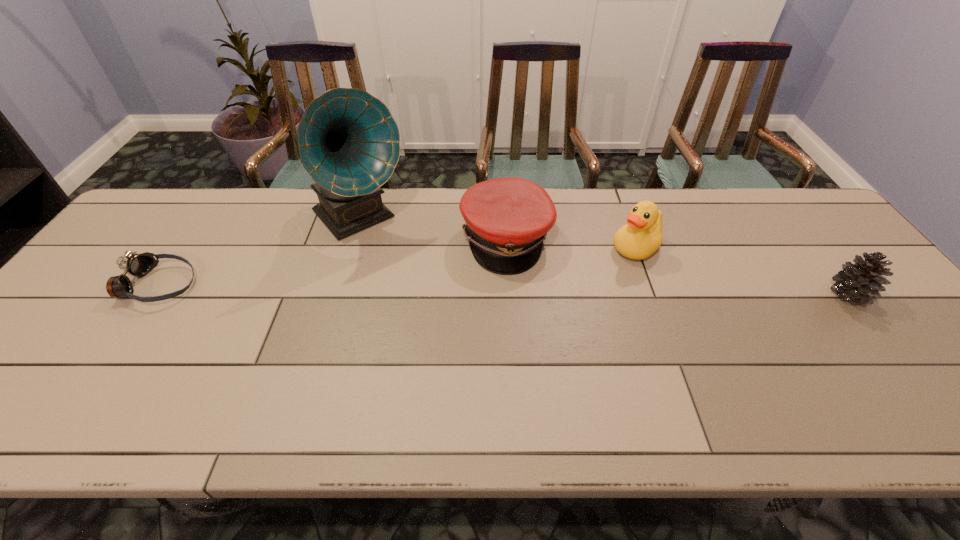
This screenshot has width=960, height=540. Find the location of `the leftmost object`. the leftmost object is located at coordinates (133, 264).

Image resolution: width=960 pixels, height=540 pixels. Find the location of `the shortest object`. the shortest object is located at coordinates (133, 264).

Where is `pinecone`? pinecone is located at coordinates (860, 283).

This screenshot has width=960, height=540. Identify the location of duck. (642, 235).

Locate an element on the screen. Image resolution: width=960 pixels, height=540 pixels. the second tallest object is located at coordinates (642, 235).

In order to click on the fourth object from right to left in this screenshot , I will do `click(348, 142)`.

At what (x,y) coordinates should I click in order to perform the action: click on the tallest object. Please return your answer as a coordinate pair (x, y). The height and width of the screenshot is (540, 960). Looking at the image, I should click on (348, 142).

I want to click on cap, so click(507, 219).

The height and width of the screenshot is (540, 960). Identify the location of vacant space located through the lenses of the leftmost object. (237, 286).

Locate an element on the screen. The image size is (960, 540). vacant space situated on the front of the rightmost object is located at coordinates (927, 393).